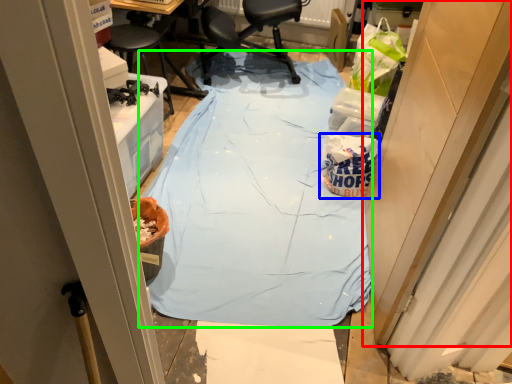
Question: Estimate the real-world distances between objects in this image. Which object is farther from door (highlighted by a red box), waste (highlighted by a blue box) or tablecloth (highlighted by a green box)?

Choices:
 (A) waste
 (B) tablecloth

Answer: (B)